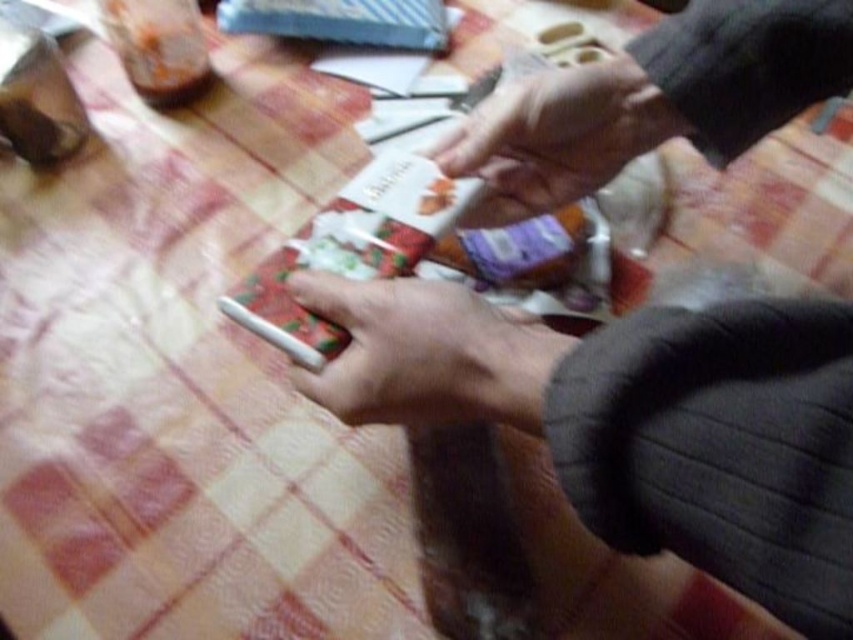
Does white matte cigarette at center appear over smooth skin hand at upper center?

No.

In the scene shown: Is white matte cigarette at center wider than smooth skin hand at upper center?

In fact, white matte cigarette at center might be narrower than smooth skin hand at upper center.

Is point (454, 420) behind point (471, 144)?

No, (454, 420) is closer to viewer.

The width and height of the screenshot is (853, 640). I want to click on white matte cigarette at center, so click(x=427, y=353).